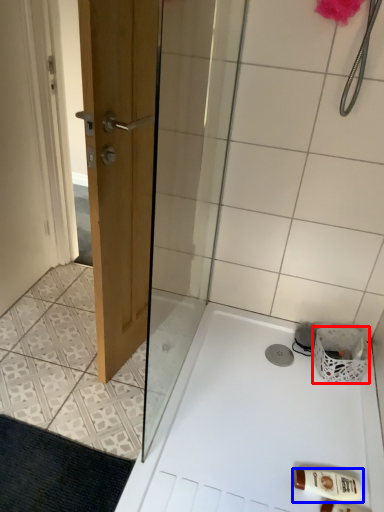
Question: Which point is closer to the camera, basket (highlighted by a red box) or toiletry (highlighted by a blue box)?

Choices:
 (A) basket
 (B) toiletry

Answer: (B)